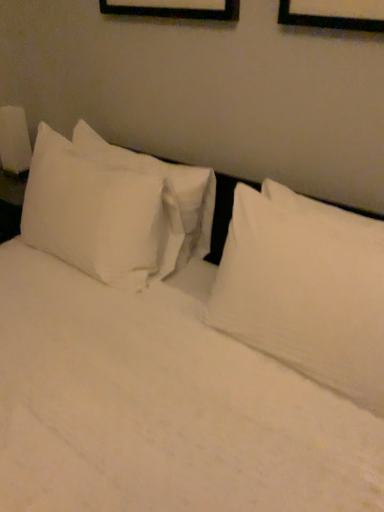
Question: Considering the relative sizes of white glossy lampshade at left and white cotton pillow at left, which appears as the first pillow when viewed from the left, in the image provided, is white glossy lampshade at left bigger than white cotton pillow at left, which appears as the first pillow when viewed from the left,?

Choices:
 (A) no
 (B) yes

Answer: (A)

Question: Is white glossy lampshade at left positioned before white cotton pillow at left, which appears as the first pillow when viewed from the left?

Choices:
 (A) no
 (B) yes

Answer: (A)

Question: Is white glossy lampshade at left surrounding white cotton pillow at left, which appears as the first pillow when viewed from the left?

Choices:
 (A) yes
 (B) no

Answer: (B)

Question: Are white glossy lampshade at left and white cotton pillow at left, which appears as the first pillow when viewed from the left, beside each other?

Choices:
 (A) no
 (B) yes

Answer: (A)

Question: Does white glossy lampshade at left have a smaller size compared to white cotton pillow at left, placed as the second pillow when sorted from right to left?

Choices:
 (A) yes
 (B) no

Answer: (A)

Question: Considering the positions of white cotton pillow at left, placed as the second pillow when sorted from right to left, and white soft pillow at upper right, the 1th pillow positioned from the right, in the image, is white cotton pillow at left, placed as the second pillow when sorted from right to left, wider or thinner than white soft pillow at upper right, the 1th pillow positioned from the right,?

Choices:
 (A) wide
 (B) thin

Answer: (A)

Question: Is point (21, 230) closer or farther from the camera than point (226, 282)?

Choices:
 (A) closer
 (B) farther

Answer: (B)

Question: Considering the positions of white cotton pillow at left, placed as the second pillow when sorted from right to left, and white soft pillow at upper right, the 1th pillow positioned from the right, in the image, is white cotton pillow at left, placed as the second pillow when sorted from right to left, taller or shorter than white soft pillow at upper right, the 1th pillow positioned from the right,?

Choices:
 (A) short
 (B) tall

Answer: (B)

Question: From a real-world perspective, relative to white soft pillow at upper right, which is the second pillow from left to right, is white cotton pillow at left, placed as the second pillow when sorted from right to left, vertically above or below?

Choices:
 (A) below
 (B) above

Answer: (A)

Question: Is point (49, 201) closer or farther from the camera than point (3, 139)?

Choices:
 (A) farther
 (B) closer

Answer: (B)

Question: Is white cotton pillow at left, placed as the second pillow when sorted from right to left, situated inside white glossy lampshade at left or outside?

Choices:
 (A) outside
 (B) inside

Answer: (A)

Question: From a real-world perspective, is white cotton pillow at left, placed as the second pillow when sorted from right to left, above or below white glossy lampshade at left?

Choices:
 (A) below
 (B) above

Answer: (A)

Question: Visually, is white cotton pillow at left, which appears as the first pillow when viewed from the left, positioned to the left or to the right of white glossy lampshade at left?

Choices:
 (A) right
 (B) left

Answer: (A)

Question: From a real-world perspective, is white soft pillow at upper right, the 1th pillow positioned from the right, positioned above or below white glossy lampshade at left?

Choices:
 (A) above
 (B) below

Answer: (A)

Question: From the image's perspective, is white soft pillow at upper right, the 1th pillow positioned from the right, above or below white glossy lampshade at left?

Choices:
 (A) below
 (B) above

Answer: (A)